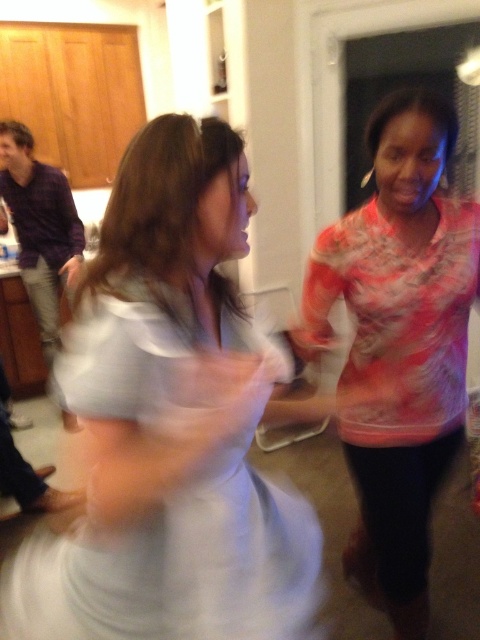
Question: Can you confirm if white satin dress at center is bigger than multicolored sheer blouse at right?

Choices:
 (A) yes
 (B) no

Answer: (B)

Question: Is white satin dress at center below multicolored sheer blouse at right?

Choices:
 (A) yes
 (B) no

Answer: (A)

Question: Which of the following is the closest to the observer?

Choices:
 (A) white satin dress at center
 (B) multicolored sheer blouse at right

Answer: (A)

Question: Observing the image, what is the correct spatial positioning of white satin dress at center in reference to multicolored sheer blouse at right?

Choices:
 (A) left
 (B) right

Answer: (A)